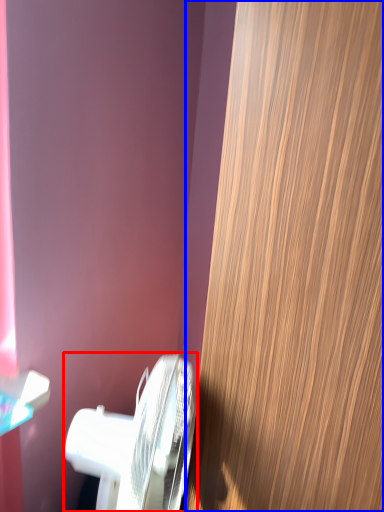
Question: Among these objects, which one is nearest to the camera, toilet (highlighted by a red box) or door (highlighted by a blue box)?

Choices:
 (A) toilet
 (B) door

Answer: (B)